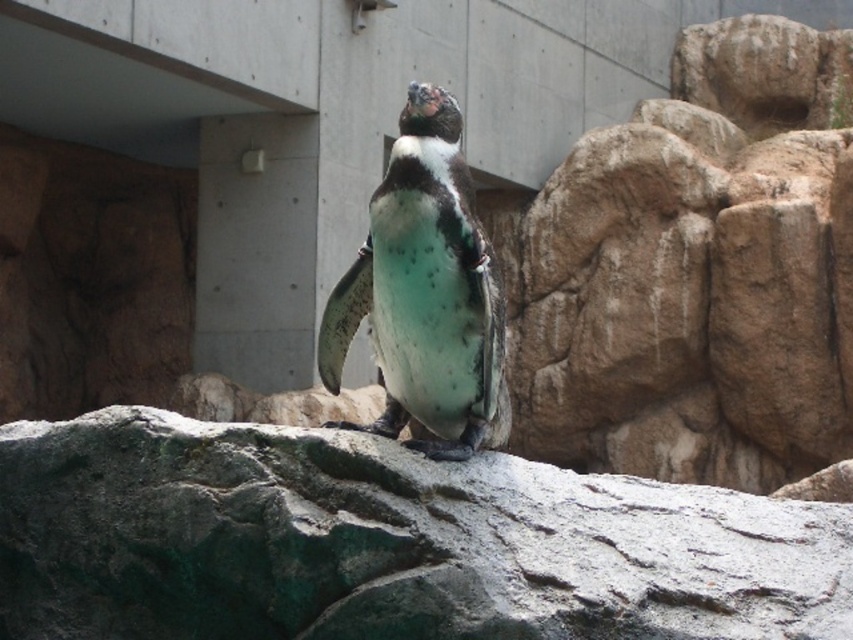
Between bumpy brown rock at right and green speckled penguin at center, which one has less height?

Standing shorter between the two is green speckled penguin at center.

Does bumpy brown rock at right have a greater width compared to green speckled penguin at center?

Yes.

Does point (711, 125) come behind point (437, 257)?

Yes, it is behind point (437, 257).

Locate an element on the screen. bumpy brown rock at right is located at coordinates (697, 272).

Find the location of a particular element. green stone at center is located at coordinates (386, 541).

Between point (163, 566) and point (804, 188), which one is positioned in front?

Point (163, 566)

You are a GUI agent. You are given a task and a screenshot of the screen. Output one action in this format:
    pyautogui.click(x=<x>, y=<y>)
    Task: Click on the green stone at center
    
    Given the screenshot: What is the action you would take?
    pyautogui.click(x=386, y=541)

The width and height of the screenshot is (853, 640). Describe the element at coordinates (386, 541) in the screenshot. I see `green stone at center` at that location.

You are a GUI agent. You are given a task and a screenshot of the screen. Output one action in this format:
    pyautogui.click(x=<x>, y=<y>)
    Task: Click on the green stone at center
    Image resolution: width=853 pixels, height=640 pixels.
    Given the screenshot: What is the action you would take?
    pyautogui.click(x=386, y=541)